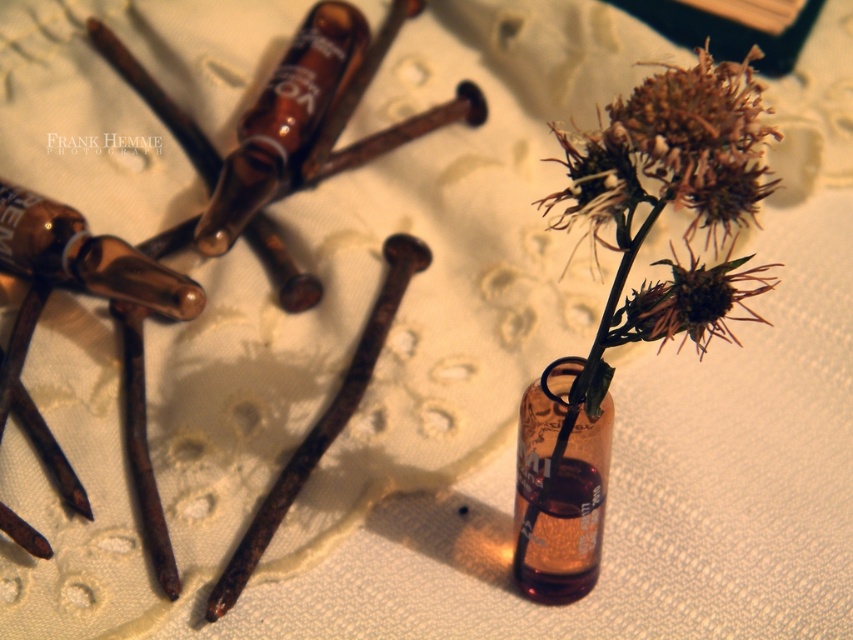
Is point (274, 170) positioned in front of point (686, 330)?

No, (274, 170) is further to viewer.

Between point (364, 44) and point (752, 273), which one is positioned behind?

Positioned behind is point (364, 44).

Image resolution: width=853 pixels, height=640 pixels. Identify the location of brown glass bottle at upper left. (282, 120).

Is point (712, 70) positioned in front of point (361, 44)?

Yes, it is in front of point (361, 44).

You are a GUI agent. You are given a task and a screenshot of the screen. Output one action in this format:
    pyautogui.click(x=<x>, y=<y>)
    Task: Click on the brown matte thistle at center
    The height and width of the screenshot is (640, 853).
    Given the screenshot: What is the action you would take?
    pyautogui.click(x=672, y=152)

Who is lower down, brown matte thistle at center or brown spiky thistle at center?

Positioned lower is brown spiky thistle at center.

Which is above, brown matte thistle at center or brown spiky thistle at center?

brown matte thistle at center is above.

Is point (689, 106) positioned after point (700, 324)?

No.

Identify the location of brown matte thistle at center. This screenshot has width=853, height=640. (672, 152).